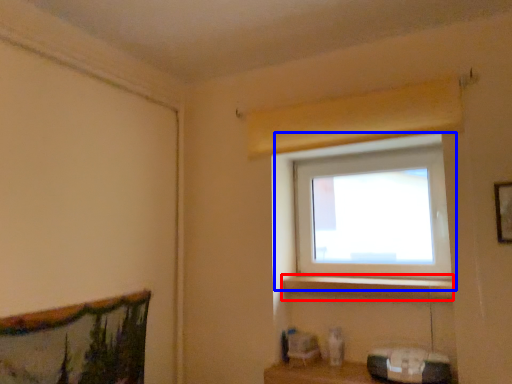
Question: Which point is closer to the camera, window sill (highlighted by a red box) or window (highlighted by a blue box)?

Choices:
 (A) window sill
 (B) window

Answer: (A)